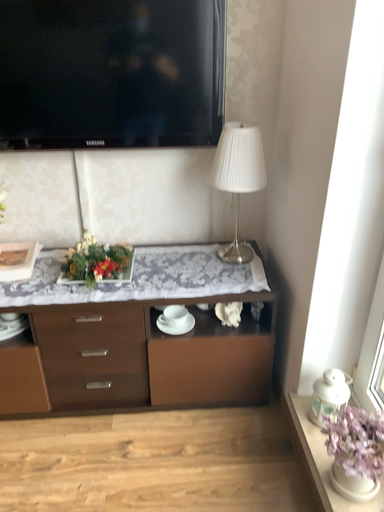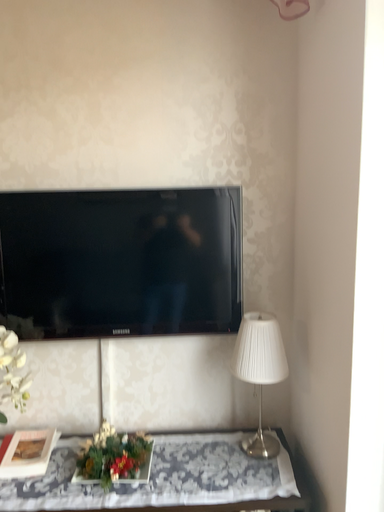
Question: Which way did the camera rotate in the video?

Choices:
 (A) rotated upward
 (B) rotated downward

Answer: (A)